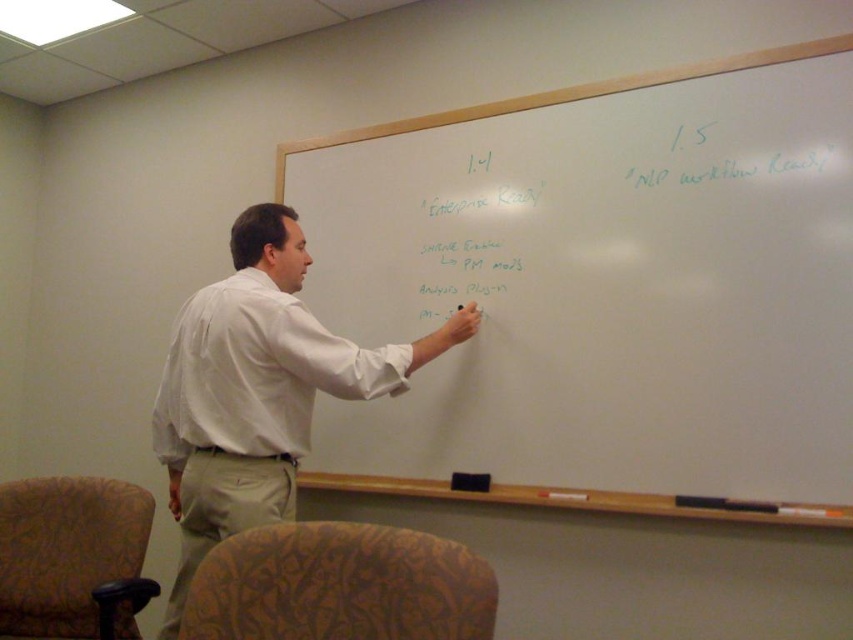
You are a photographer positioned at the origin point of the coordinate system. You want to take a photo of the white cotton shirt at center. What are the coordinates where you should aim your camera?

The coordinates to aim the camera are at point [259,388] where the white cotton shirt at center is located.

You are a person with a 1.2 meters wide wheelchair. You want to move from the entrance to the whiteboard in the classroom. Is there enough space between the patterned fabric armchair at lower left and the white matte text at center for your wheelchair to pass through?

The patterned fabric armchair at lower left might be wider than white matte text at center, so there may not be enough space for a wheelchair that is 1.2 meters wide to pass through safely. It is advisable to check the actual width or seek an alternative path.